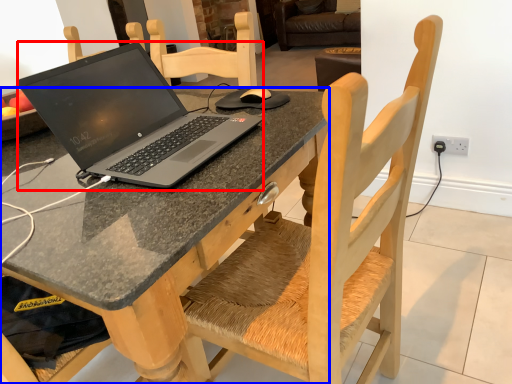
Question: Which point is closer to the camera, laptop (highlighted by a red box) or desk (highlighted by a blue box)?

Choices:
 (A) laptop
 (B) desk

Answer: (B)